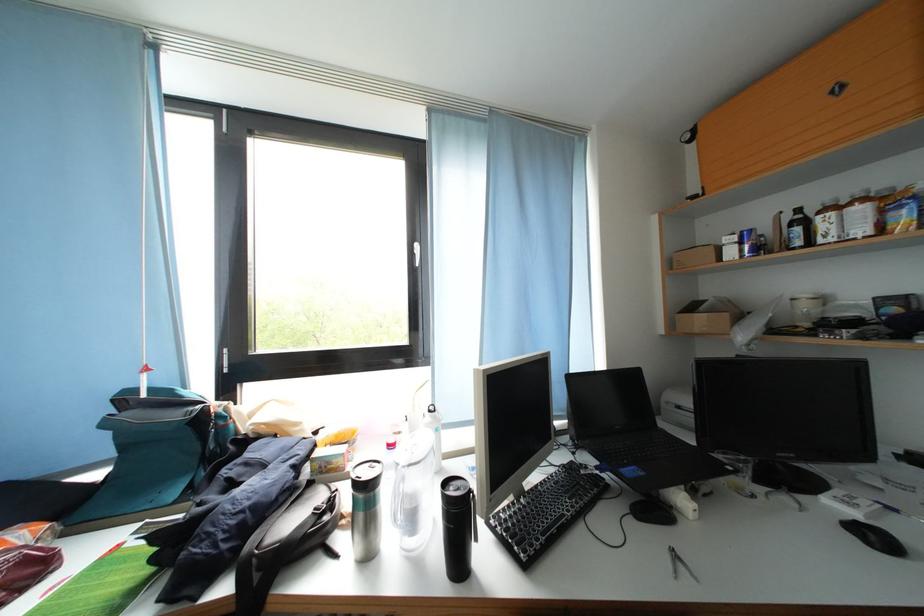
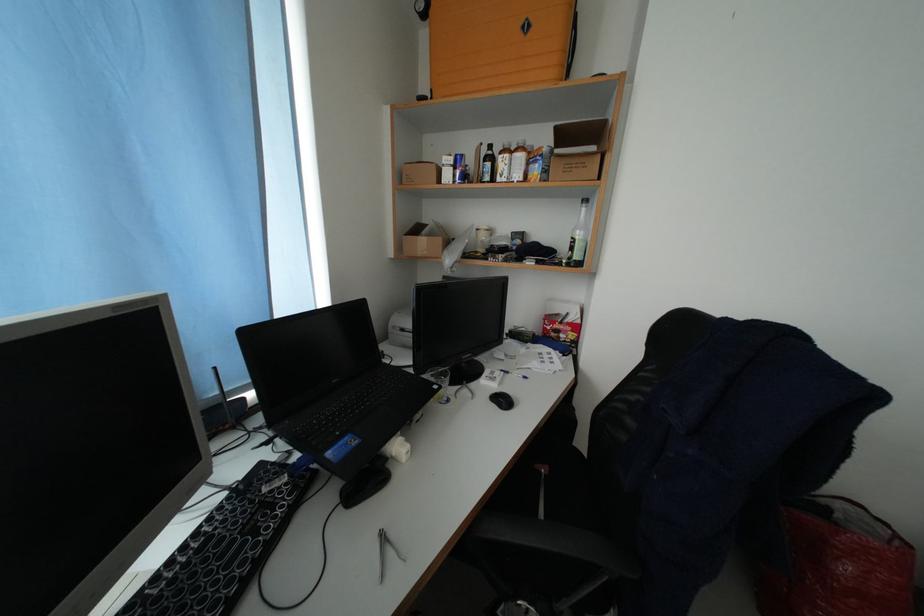
Locate, in the second image, the point that corresponds to (684,560) in the first image.

(393, 543)